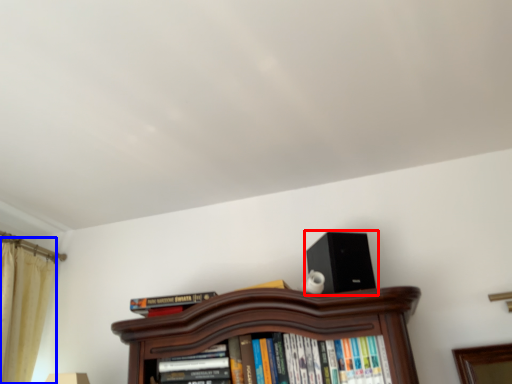
Question: Which object is closer to the camera taking this photo, loudspeaker (highlighted by a red box) or curtain (highlighted by a blue box)?

Choices:
 (A) loudspeaker
 (B) curtain

Answer: (A)